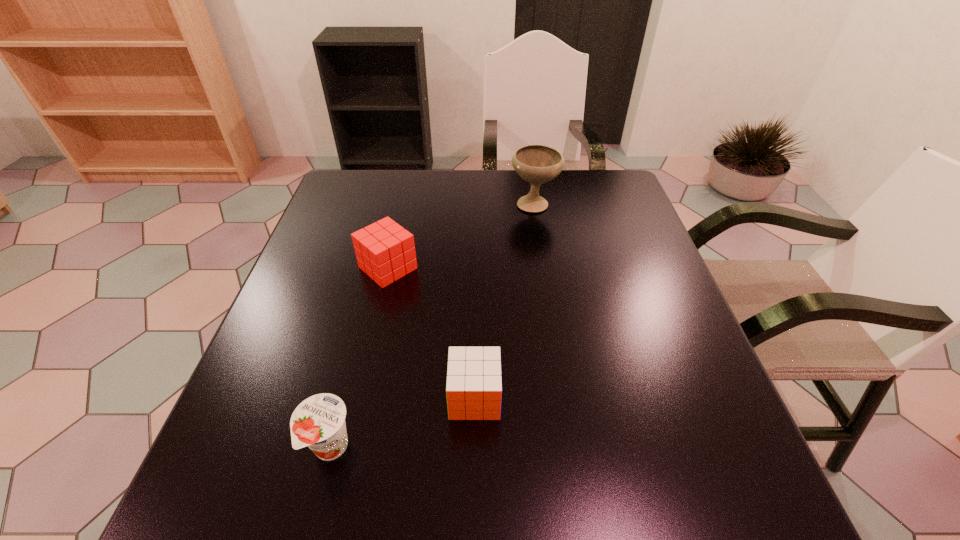
In order to click on vacant area that lies between the right cube and the nearest object in this screenshot , I will do `click(402, 423)`.

Where is `vacant space that's between the yogurt and the left cube`? vacant space that's between the yogurt and the left cube is located at coordinates (359, 358).

Identify the location of object that is the third closest to the left cube. Image resolution: width=960 pixels, height=540 pixels. (318, 422).

Identify the location of object that ranks as the closest to the rightmost object. (385, 251).

Identify the location of vacant space that satisfies the following two spatial constraints: 1. on the back side of the tallest object; 2. on the left side of the third farthest object. The image size is (960, 540). (477, 203).

The image size is (960, 540). I want to click on vacant area that satisfies the following two spatial constraints: 1. on the back side of the farther cube; 2. on the left side of the farthest object, so click(403, 203).

Where is `vacant position in the image that satisfies the following two spatial constraints: 1. on the back side of the nearest object; 2. on the right side of the third farthest object`? vacant position in the image that satisfies the following two spatial constraints: 1. on the back side of the nearest object; 2. on the right side of the third farthest object is located at coordinates (344, 397).

Where is `free space that satisfies the following two spatial constraints: 1. on the back side of the left cube; 2. on the right side of the farthest object`? free space that satisfies the following two spatial constraints: 1. on the back side of the left cube; 2. on the right side of the farthest object is located at coordinates (403, 203).